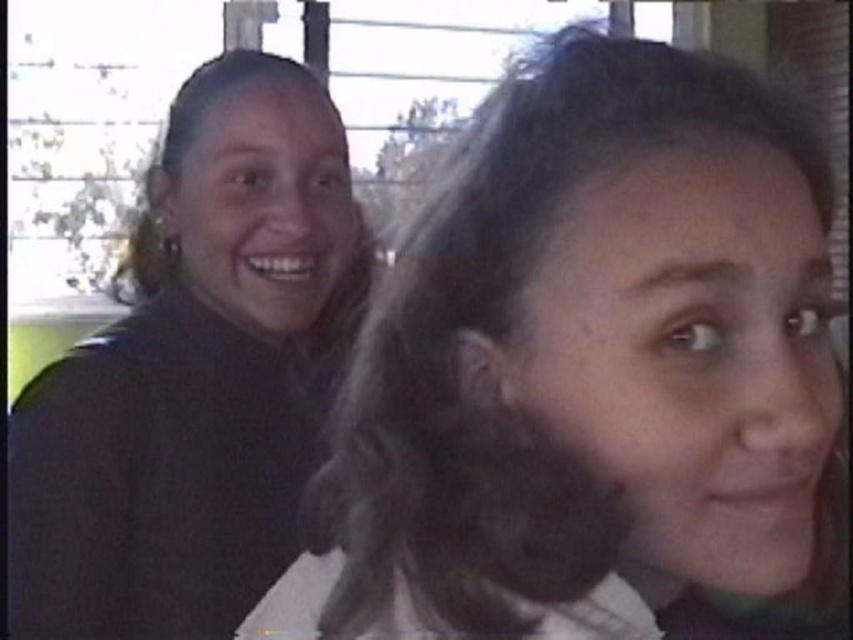
You are taking a selfie and want to ensure both the dark brown hair at upper center and the matte black jacket at left are clearly visible. Based on their positions, which object is closer to the camera?

The dark brown hair at upper center is closer to the viewer than the matte black jacket at left, so it will appear larger and more prominent in the selfie.

You are trying to identify the position of the dark brown hair at upper center in the selfie. According to the coordinates provided, where exactly is it placed?

The dark brown hair at upper center is located at point 0.586 on the x axis and 0.695 on the y axis.